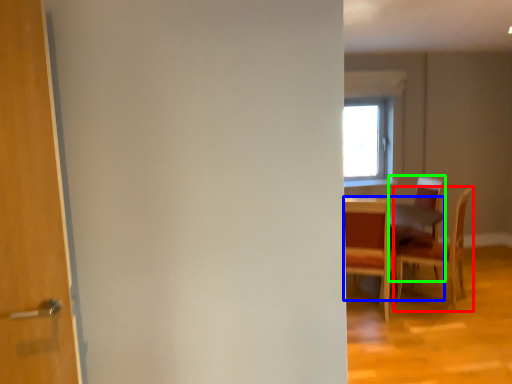
Question: Estimate the real-world distances between objects in this image. Which object is closer to chair (highlighted by a red box), table (highlighted by a blue box) or chair (highlighted by a green box)?

Choices:
 (A) table
 (B) chair

Answer: (B)